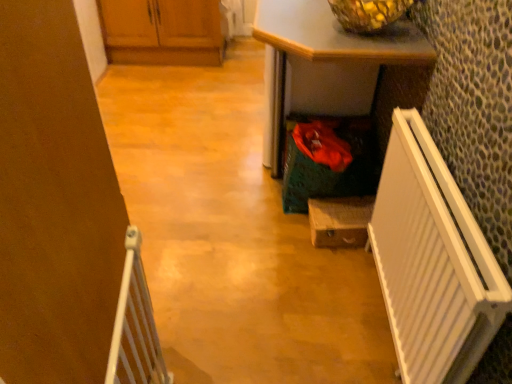
The image size is (512, 384). I want to click on vacant area that lies between green textured desk at center and white plastic radiator at right, the second radiator viewed from the left, so click(x=318, y=289).